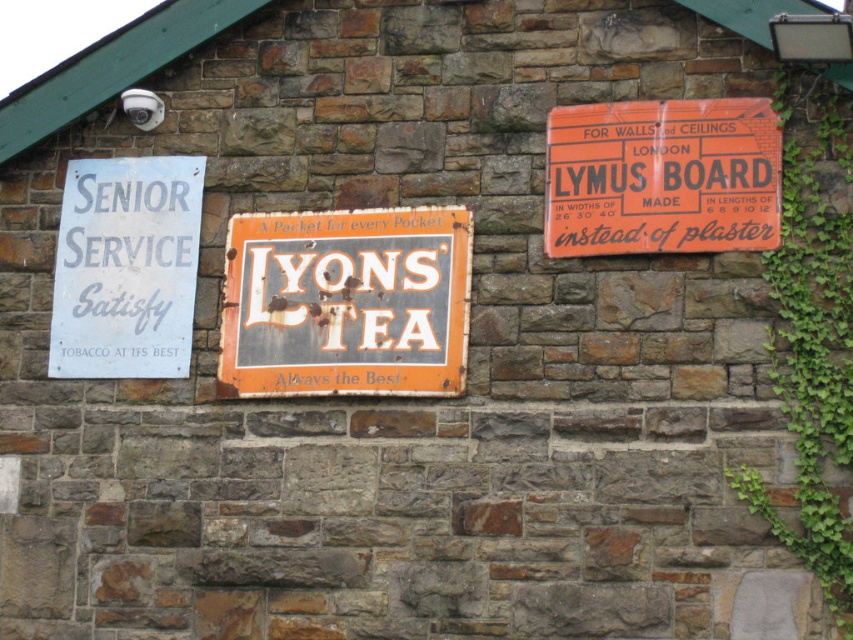
Can you confirm if rusty metal signboard at center is bigger than green leafy ivy at right?

No, rusty metal signboard at center is not bigger than green leafy ivy at right.

Does rusty metal signboard at center have a greater width compared to green leafy ivy at right?

Yes, rusty metal signboard at center is wider than green leafy ivy at right.

You are a GUI agent. You are given a task and a screenshot of the screen. Output one action in this format:
    pyautogui.click(x=<x>, y=<y>)
    Task: Click on the rusty metal signboard at center
    
    Given the screenshot: What is the action you would take?
    pyautogui.click(x=346, y=301)

Who is higher up, rusty metal signboard at center or orange cardboard sign at upper right?

Positioned higher is orange cardboard sign at upper right.

This screenshot has width=853, height=640. Find the location of `rusty metal signboard at center`. rusty metal signboard at center is located at coordinates (346, 301).

Which is in front, point (341, 344) or point (741, 152)?

Point (741, 152) is more forward.

Identify the location of rusty metal signboard at center. (346, 301).

Does orange cardboard sign at upper right appear under white paper sign at left?

Actually, orange cardboard sign at upper right is above white paper sign at left.

Is point (560, 220) behind point (82, 180)?

No, it is in front of (82, 180).

Is point (552, 216) farther from camera compared to point (163, 200)?

No, it is in front of (163, 200).

What are the coordinates of `orange cardboard sign at upper right` in the screenshot? It's located at (662, 177).